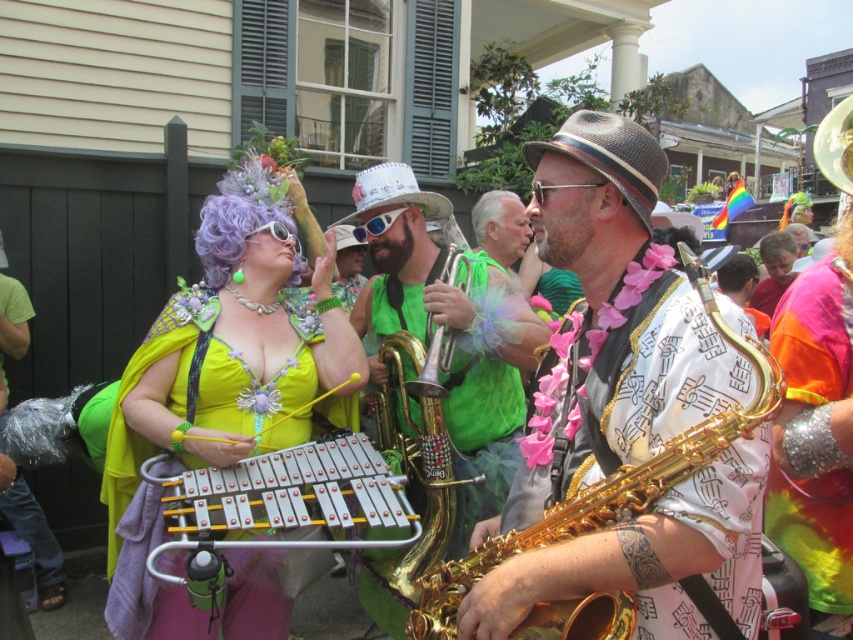
You are a photographer standing at the edge of the street, wanting to capture a photo of both the shiny gold saxophone at center and the shiny sequined arm band at center in the same frame. The minimum distance between the two objects must be at least 5 feet to ensure they are both visible clearly. Can you fit both objects in your camera frame?

The shiny gold saxophone at center and the shiny sequined arm band at center are 4.95 feet apart, which is less than the required 5 feet. Therefore, it might be challenging to capture both in the same frame clearly as they are too close together.

From the picture: You are a photographer standing in the middle of the street during the parade. You want to take a photo that includes both the orange fabric shirt at center and the gray synthetic wig at center. Which object should you position on the right side of your camera frame to ensure both are visible?

To include both the orange fabric shirt at center and the gray synthetic wig at center in the photo, position the gray synthetic wig at center on the right side of the camera frame since the orange fabric shirt at center is already to the right of the gray synthetic wig at center.

You are a photographer standing at the center of the street. You want to take a photo of the orange fabric shirt at center. Where should you aim your camera to capture it in the frame?

The orange fabric shirt at center is located at the coordinates point (775, 269), so you should aim your camera towards that point to capture it in the frame.